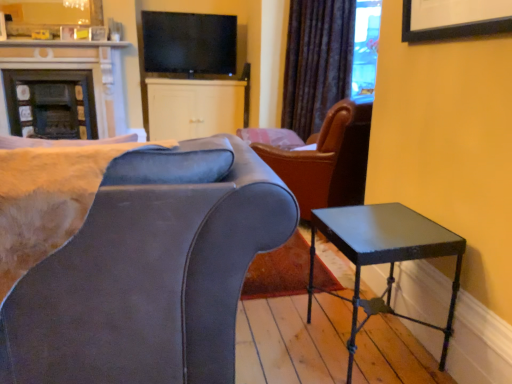
What do you see at coordinates (189, 43) in the screenshot? This screenshot has height=384, width=512. I see `matte black tv at upper center` at bounding box center [189, 43].

I want to click on matte black tv at upper center, so click(189, 43).

What do you see at coordinates (384, 255) in the screenshot? Image resolution: width=512 pixels, height=384 pixels. I see `metallic black side table at lower right` at bounding box center [384, 255].

Measure the distance between point (381, 212) and camera.

They are 1.65 meters apart.

This screenshot has width=512, height=384. Find the location of `white matte cabinet at center`. white matte cabinet at center is located at coordinates (194, 107).

Describe the element at coordinates (70, 69) in the screenshot. This screenshot has width=512, height=384. I see `matte black fireplace at upper left` at that location.

Locate an element on the screen. Image resolution: width=512 pixels, height=384 pixels. matte black tv at upper center is located at coordinates (189, 43).

Which object is thinner, white matte cabinet at center or suede-like gray chair at left?

With smaller width is white matte cabinet at center.

Is white matte cabinet at center with suede-like gray chair at left?

No, white matte cabinet at center is not in contact with suede-like gray chair at left.

In terms of size, does white matte cabinet at center appear bigger or smaller than suede-like gray chair at left?

Considering their sizes, white matte cabinet at center takes up less space than suede-like gray chair at left.

This screenshot has width=512, height=384. I want to click on chair below the white matte cabinet at center (from a real-world perspective), so click(x=131, y=258).

Does velvet dark brown curtain at upper center have a smaller size compared to white matte cabinet at center?

Yes.

Where is `cabinetry that is behind the velvet dark brown curtain at upper center`? cabinetry that is behind the velvet dark brown curtain at upper center is located at coordinates (194, 107).

In the scene shown: Which object is more forward, velvet dark brown curtain at upper center or white matte cabinet at center?

Positioned in front is velvet dark brown curtain at upper center.

Is suede-like gray chair at left inside or outside of white matte cabinet at center?

suede-like gray chair at left is spatially situated outside white matte cabinet at center.

Who is more distant, suede-like gray chair at left or white matte cabinet at center?

Positioned behind is white matte cabinet at center.

At what (x,y) coordinates should I click in order to perform the action: click on chair that appears in front of the white matte cabinet at center. Please return your answer as a coordinate pair (x, y). This screenshot has height=384, width=512. Looking at the image, I should click on (131, 258).

Between point (116, 182) and point (172, 125), which one is positioned in front?

The point (116, 182) is in front.

Which of these two, velvet dark brown curtain at upper center or matte black fireplace at upper left, stands taller?

velvet dark brown curtain at upper center.

Is velvet dark brown curtain at upper center positioned with its back to matte black fireplace at upper left?

No, velvet dark brown curtain at upper center is not facing the opposite direction of matte black fireplace at upper left.

Can you tell me how much velvet dark brown curtain at upper center and matte black fireplace at upper left differ in facing direction?

42.4 degrees separate the facing orientations of velvet dark brown curtain at upper center and matte black fireplace at upper left.

Does velvet dark brown curtain at upper center touch matte black fireplace at upper left?

No, velvet dark brown curtain at upper center is not making contact with matte black fireplace at upper left.

Is velvet dark brown curtain at upper center with metallic black side table at lower right?

No, velvet dark brown curtain at upper center is not touching metallic black side table at lower right.

From the image's perspective, would you say velvet dark brown curtain at upper center is positioned over metallic black side table at lower right?

Correct, velvet dark brown curtain at upper center appears higher than metallic black side table at lower right in the image.

Considering the relative sizes of velvet dark brown curtain at upper center and metallic black side table at lower right in the image provided, is velvet dark brown curtain at upper center taller than metallic black side table at lower right?

Indeed, velvet dark brown curtain at upper center has a greater height compared to metallic black side table at lower right.

Would you say matte black tv at upper center is a long distance from metallic black side table at lower right?

Yes, matte black tv at upper center and metallic black side table at lower right are located far from each other.

I want to click on television located behind the metallic black side table at lower right, so click(x=189, y=43).

From the image's perspective, which is below, matte black tv at upper center or metallic black side table at lower right?

metallic black side table at lower right is shown below in the image.

Considering the positions of point (164, 31) and point (416, 244), is point (164, 31) closer or farther from the camera than point (416, 244)?

Point (164, 31) is positioned farther from the camera compared to point (416, 244).

Could you measure the distance between matte black fireplace at upper left and metallic black side table at lower right?

matte black fireplace at upper left and metallic black side table at lower right are 14.21 feet apart.

Choose the correct answer: Is matte black fireplace at upper left inside metallic black side table at lower right or outside it?

matte black fireplace at upper left exists outside the volume of metallic black side table at lower right.

Is matte black fireplace at upper left taller than metallic black side table at lower right?

Indeed, matte black fireplace at upper left has a greater height compared to metallic black side table at lower right.

Can you tell me how much matte black fireplace at upper left and metallic black side table at lower right differ in facing direction?

They differ by 85.5 degrees in their facing directions.

This screenshot has height=384, width=512. I want to click on chair that is on the right side of white matte cabinet at center, so click(131, 258).

Where is `cabinetry on the left of velvet dark brown curtain at upper center`? The height and width of the screenshot is (384, 512). cabinetry on the left of velvet dark brown curtain at upper center is located at coordinates (194, 107).

Based on their spatial positions, is matte black tv at upper center or metallic black side table at lower right further from velvet dark brown curtain at upper center?

metallic black side table at lower right is positioned further to the anchor velvet dark brown curtain at upper center.

Looking at the image, which one is located further to suede-like gray chair at left, metallic black side table at lower right or matte black fireplace at upper left?

The object further to suede-like gray chair at left is matte black fireplace at upper left.

Based on their spatial positions, is velvet dark brown curtain at upper center or matte black tv at upper center further from white matte cabinet at center?

velvet dark brown curtain at upper center is positioned further to the anchor white matte cabinet at center.

Looking at this image, considering their positions, is matte black tv at upper center positioned closer to matte black fireplace at upper left than suede-like gray chair at left?

Based on the image, matte black tv at upper center appears to be nearer to matte black fireplace at upper left.

From the picture: Based on their spatial positions, is suede-like gray chair at left or metallic black side table at lower right closer to white matte cabinet at center?

Based on the image, metallic black side table at lower right appears to be nearer to white matte cabinet at center.

Based on their spatial positions, is white matte cabinet at center or metallic black side table at lower right closer to suede-like gray chair at left?

Based on the image, metallic black side table at lower right appears to be nearer to suede-like gray chair at left.

When comparing their distances from matte black tv at upper center, does velvet dark brown curtain at upper center or metallic black side table at lower right seem closer?

Among the two, velvet dark brown curtain at upper center is located nearer to matte black tv at upper center.

When comparing their distances from metallic black side table at lower right, does suede-like gray chair at left or white matte cabinet at center seem further?

The object further to metallic black side table at lower right is white matte cabinet at center.

Identify the location of curtain located between metallic black side table at lower right and matte black tv at upper center in the depth direction. (317, 62).

Locate an element on the screen. television located between matte black fireplace at upper left and white matte cabinet at center in the left-right direction is located at coordinates (189, 43).

Identify the location of curtain between suede-like gray chair at left and white matte cabinet at center from front to back. This screenshot has width=512, height=384. (317, 62).

Locate an element on the screen. This screenshot has height=384, width=512. television positioned between metallic black side table at lower right and white matte cabinet at center from near to far is located at coordinates (189, 43).